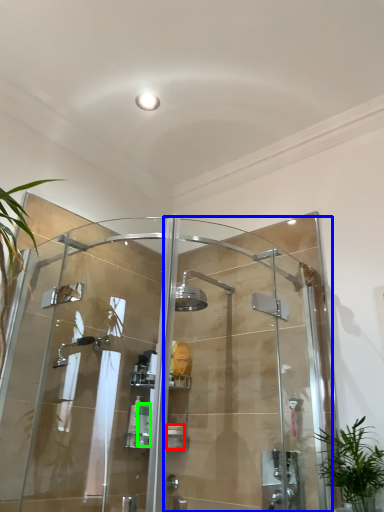
Question: Considering the real-world distances, which object is closest to toiletry (highlighted by a red box)? screen door (highlighted by a blue box) or toiletry (highlighted by a green box).

Choices:
 (A) screen door
 (B) toiletry

Answer: (B)